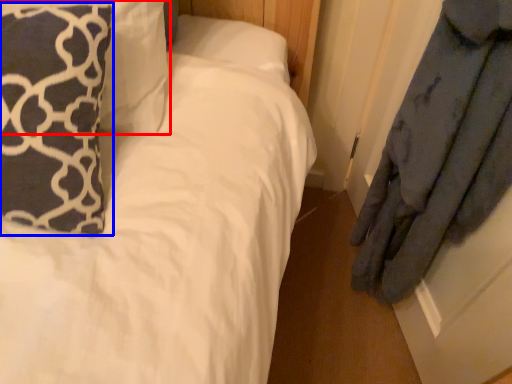
Question: Which object appears farthest to the camera in this image, pillow (highlighted by a red box) or pillow (highlighted by a blue box)?

Choices:
 (A) pillow
 (B) pillow

Answer: (A)